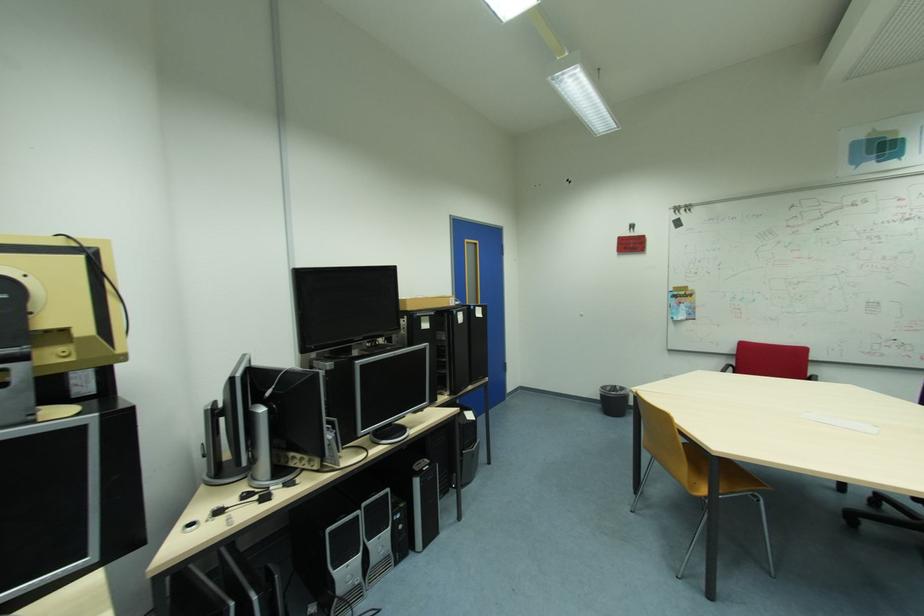
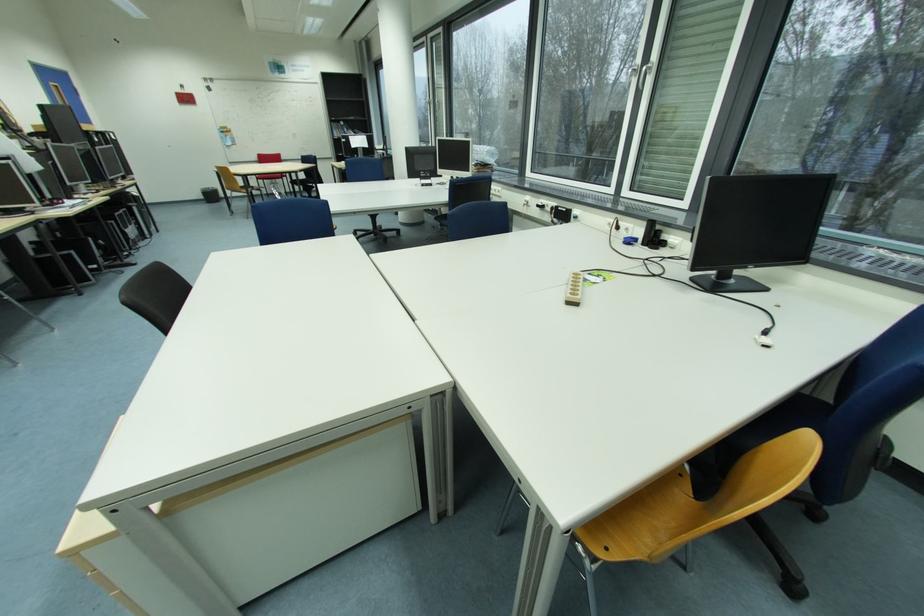
Find the pixel in the second image that matches (605,400) in the first image.

(209, 198)